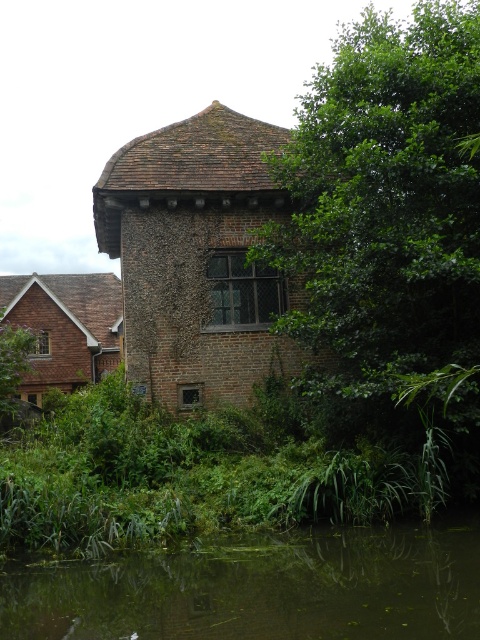
You are standing at the entrance of the old brick building and want to find the green leafy tree at center. According to the coordinates provided, in which direction should you look to locate it?

The green leafy tree at center is located at coordinates point (385, 202), which means it is positioned to the left and slightly above the center of the image. You should look to the left and upwards from the center to find it.

You are standing at the edge of the green mossy water at lower center and want to reach the green leafy tree at center. Which direction should you move to get there?

The green leafy tree at center is to the right of green mossy water at lower center, so you should move to the right to reach it.

You are standing in front of the old brick building and notice the green leafy tree at center and the green mossy water at lower center. Which object is closer to you?

The green leafy tree at center is closer to you because it is further to the viewer than the green mossy water at lower center.